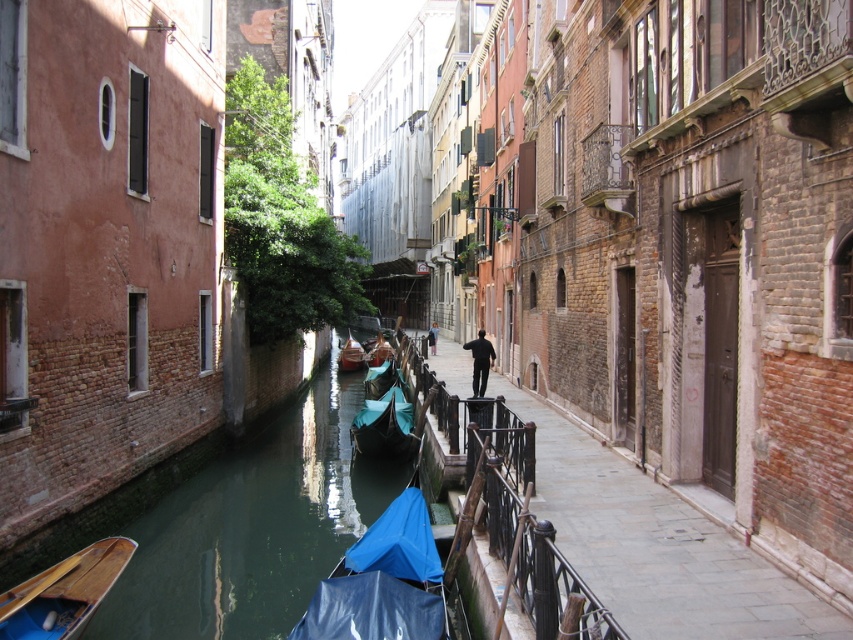
Question: Which object is farther from the camera taking this photo?

Choices:
 (A) teal fabric gondola at center
 (B) blue tarpaulin boat at lower center

Answer: (A)

Question: Can you confirm if green water at canal left is positioned to the right of black matte person at center?

Choices:
 (A) yes
 (B) no

Answer: (B)

Question: Which of the following is the closest to the observer?

Choices:
 (A) dark blue fabric at center
 (B) green water at canal left
 (C) blue tarpaulin boat at lower center

Answer: (C)

Question: Which object appears farthest from the camera in this image?

Choices:
 (A) dark blue fabric at center
 (B) blue tarpaulin boat at center
 (C) teal fabric gondola at center

Answer: (C)

Question: Does black matte person at center appear under blue tarpaulin boat at center?

Choices:
 (A) no
 (B) yes

Answer: (A)

Question: Does dark blue fabric at center appear on the right side of teal fabric gondola at center?

Choices:
 (A) no
 (B) yes

Answer: (B)